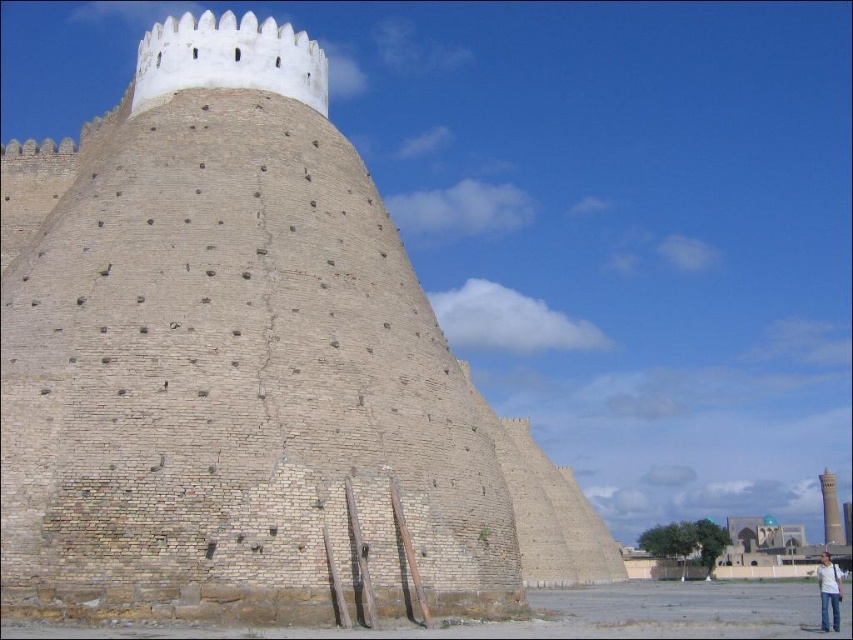
Question: Which point appears farthest from the camera in this image?

Choices:
 (A) (117, 129)
 (B) (827, 468)

Answer: (B)

Question: Is beige brick fort at center in front of smooth beige tower at right?

Choices:
 (A) yes
 (B) no

Answer: (A)

Question: Is beige brick fort at center above smooth beige tower at right?

Choices:
 (A) yes
 (B) no

Answer: (A)

Question: Does beige brick fort at center lie in front of smooth beige tower at right?

Choices:
 (A) no
 (B) yes

Answer: (B)

Question: Which point is farther from the camera taking this photo?

Choices:
 (A) (173, 410)
 (B) (822, 490)

Answer: (B)